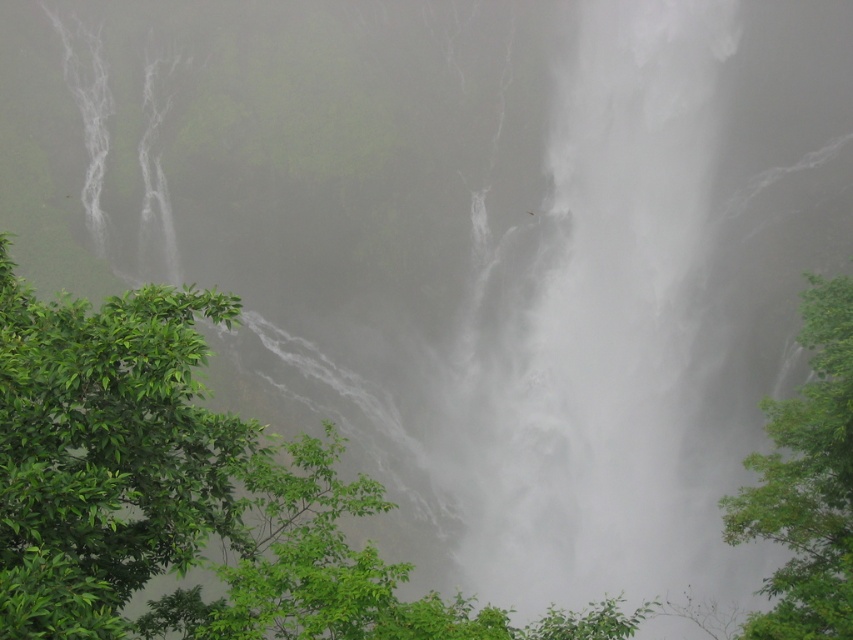
Who is positioned more to the left, green leafy tree at left or green leafy tree at right?

From the viewer's perspective, green leafy tree at left appears more on the left side.

Can you confirm if green leafy tree at left is thinner than green leafy tree at right?

Yes.

Find the location of a particular element. This screenshot has height=640, width=853. green leafy tree at left is located at coordinates 105,452.